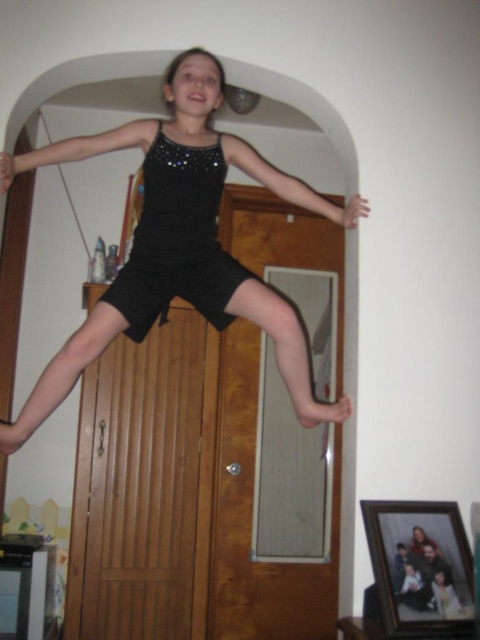
You are a fashion designer trying to create a cohesive outfit for a client. The client wants to wear both the black matte shorts at center and the black satin dress at center. Based on their sizes, which item should be worn on top and which on bottom to ensure proper layering?

The black satin dress at center should be worn on top and the black matte shorts at center on the bottom since the shorts are wider, allowing the dress to layer neatly over them without bunching.

You are a fashion designer observing the image of the girl wearing the black matte shorts at center and the black satin dress at center. Which item of clothing is shorter in length?

The black matte shorts at center is not as tall as black satin dress at center, so the black matte shorts at center is shorter in length.